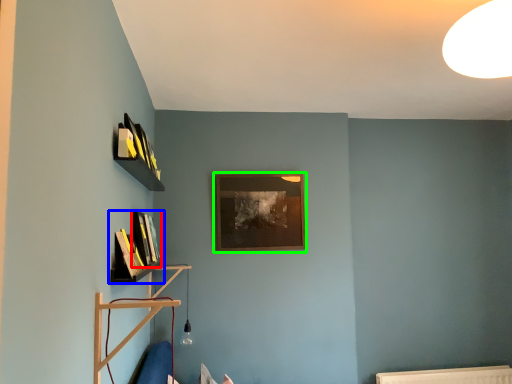
Question: Which object is the farthest from book (highlighted by a red box)? Choose among these: shelf (highlighted by a blue box) or picture frame (highlighted by a green box).

Choices:
 (A) shelf
 (B) picture frame

Answer: (B)